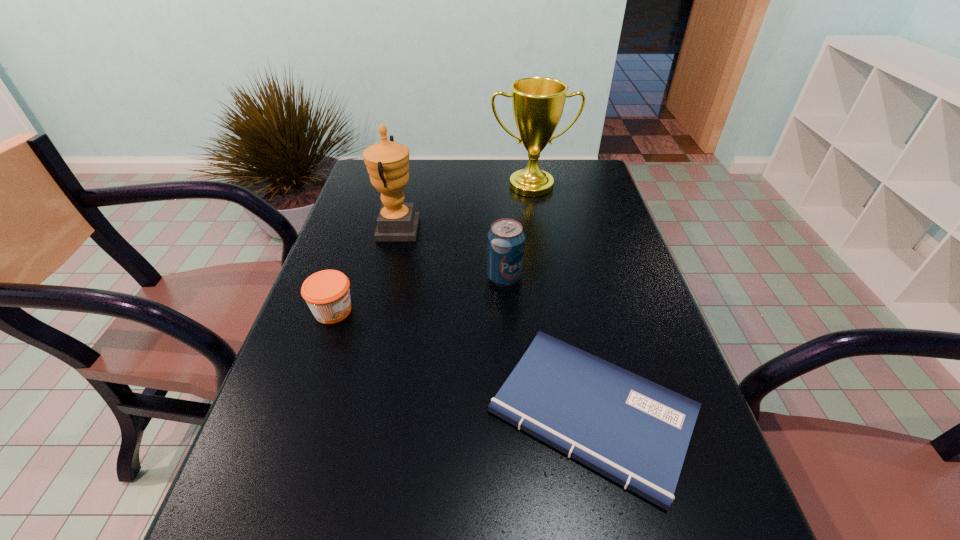
This screenshot has height=540, width=960. Identify the location of vacant space that's between the nearer award and the second nearest object. (365, 271).

Find the location of a particular element. The height and width of the screenshot is (540, 960). free space between the right award and the shortest object is located at coordinates (562, 299).

Locate which object is the closest to the shortest object. Please provide its 2D coordinates. Your answer should be formatted as a tuple, i.e. [(x, y)], where the tuple contains the x and y coordinates of a point satisfying the conditions above.

[(506, 239)]

You are a GUI agent. You are given a task and a screenshot of the screen. Output one action in this format:
    pyautogui.click(x=<x>, y=<y>)
    Task: Click on the third closest object relative to the paperback book
    Image resolution: width=960 pixels, height=540 pixels.
    Given the screenshot: What is the action you would take?
    click(387, 162)

You are a GUI agent. You are given a task and a screenshot of the screen. Output one action in this format:
    pyautogui.click(x=<x>, y=<y>)
    Task: Click on the vacant point that satisfies the following two spatial constraints: 1. by the handles of the right award; 2. at the front of the left award with handles
    
    Given the screenshot: What is the action you would take?
    pyautogui.click(x=539, y=230)

Identify the location of vacant space that satisfies the following two spatial constraints: 1. on the back side of the paperback book; 2. on the front label of the fourth farthest object. (571, 311).

You are a GUI agent. You are given a task and a screenshot of the screen. Output one action in this format:
    pyautogui.click(x=<x>, y=<y>)
    Task: Click on the blank area in the image that satisfies the following two spatial constraints: 1. on the back side of the third farthest object; 2. at the front of the second farthest object with handles
    The height and width of the screenshot is (540, 960).
    Given the screenshot: What is the action you would take?
    click(501, 230)

Where is `free space that satisfies the following two spatial constraints: 1. by the handles of the farther award; 2. on the right side of the nearest object`? This screenshot has width=960, height=540. free space that satisfies the following two spatial constraints: 1. by the handles of the farther award; 2. on the right side of the nearest object is located at coordinates (568, 413).

Locate an element on the screen. free location that satisfies the following two spatial constraints: 1. on the front label of the shortest object; 2. on the right side of the second nearest object is located at coordinates (299, 413).

Locate an element on the screen. This screenshot has height=540, width=960. vacant space that satisfies the following two spatial constraints: 1. at the front of the left award with handles; 2. on the back side of the paperback book is located at coordinates (354, 413).